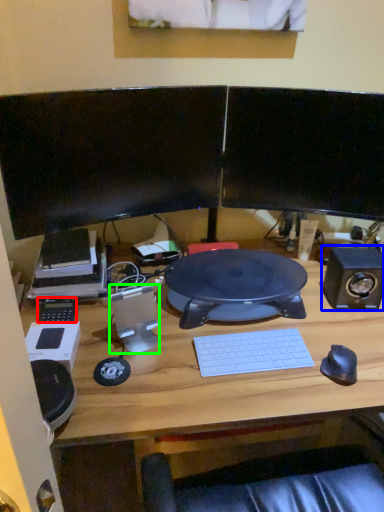
Question: Considering the real-world distances, which object is farthest from equipment (highlighted by a red box)? speaker (highlighted by a blue box) or speaker (highlighted by a green box)?

Choices:
 (A) speaker
 (B) speaker

Answer: (A)